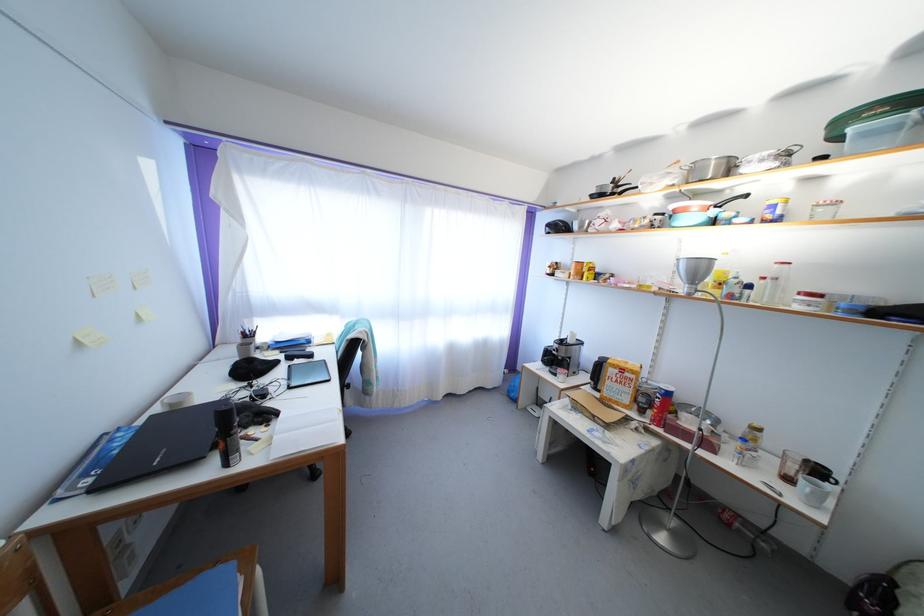
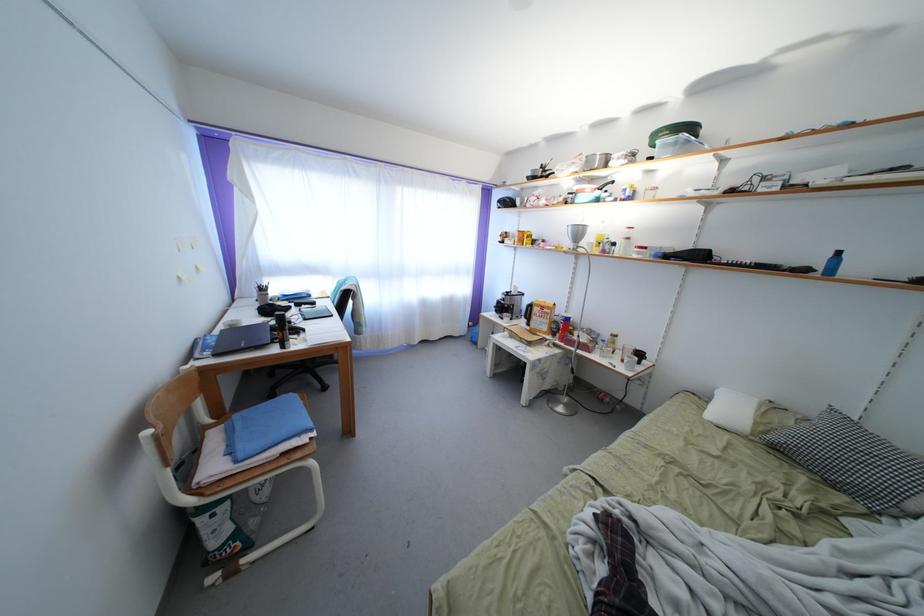
Locate, in the second image, the point that corresponds to the point at 261,365 in the first image.

(277, 310)